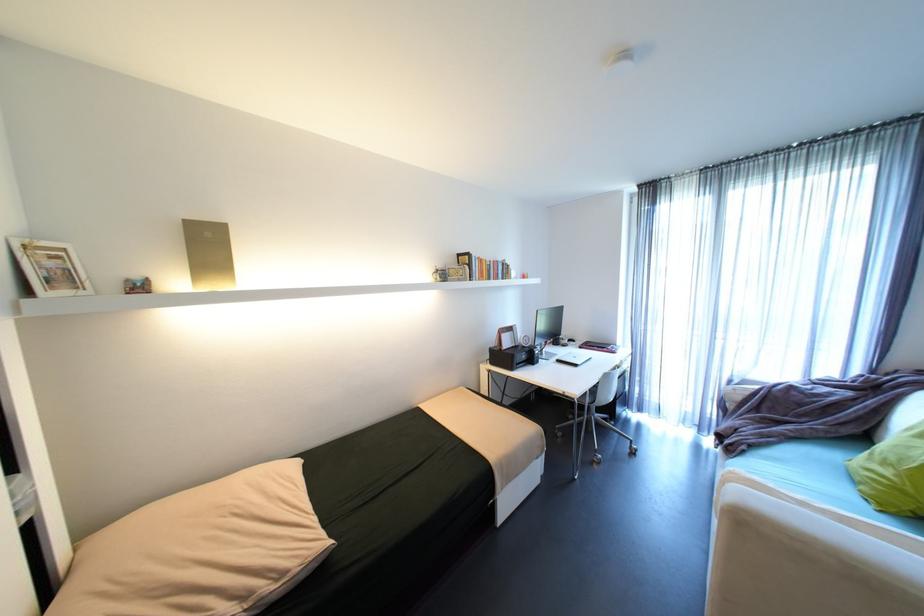
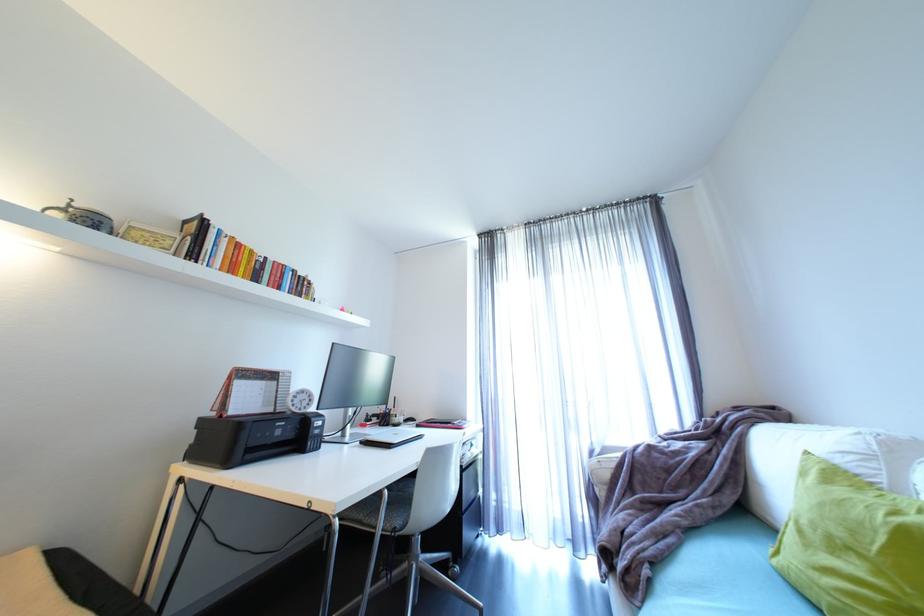
The point at (480,278) is marked in the first image. Where is the corresponding point in the second image?

(208, 262)